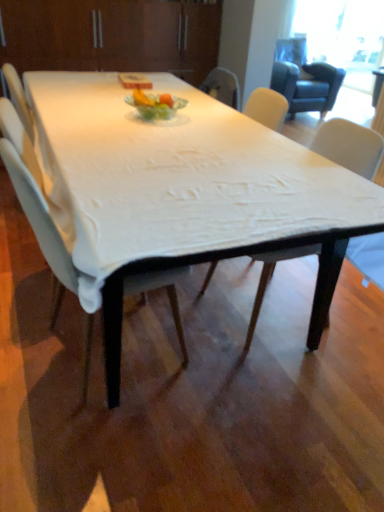
Question: Considering the positions of white glass plate at center and white fabric chair at center, the first chair viewed from the right, in the image, is white glass plate at center wider or thinner than white fabric chair at center, the first chair viewed from the right,?

Choices:
 (A) thin
 (B) wide

Answer: (A)

Question: In the image, is white glass plate at center positioned in front of or behind white fabric chair at center, the first chair viewed from the right?

Choices:
 (A) front
 (B) behind

Answer: (B)

Question: Estimate the real-world distances between objects in this image. Which object is closer to the white fabric chair at center, arranged as the 1th chair when viewed from the left?

Choices:
 (A) transparent glass window screen at upper right
 (B) white fabric chair at center, the first chair viewed from the right
 (C) white fabric table at center
 (D) white glass plate at center
 (E) white fabric-covered table at center

Answer: (E)

Question: Which object is the closest to the white fabric table at center?

Choices:
 (A) white fabric chair at center, acting as the second chair starting from the right
 (B) white fabric chair at center, marked as the second chair in a left-to-right arrangement
 (C) white glass plate at center
 (D) white fabric-covered table at center
 (E) transparent glass window screen at upper right

Answer: (E)